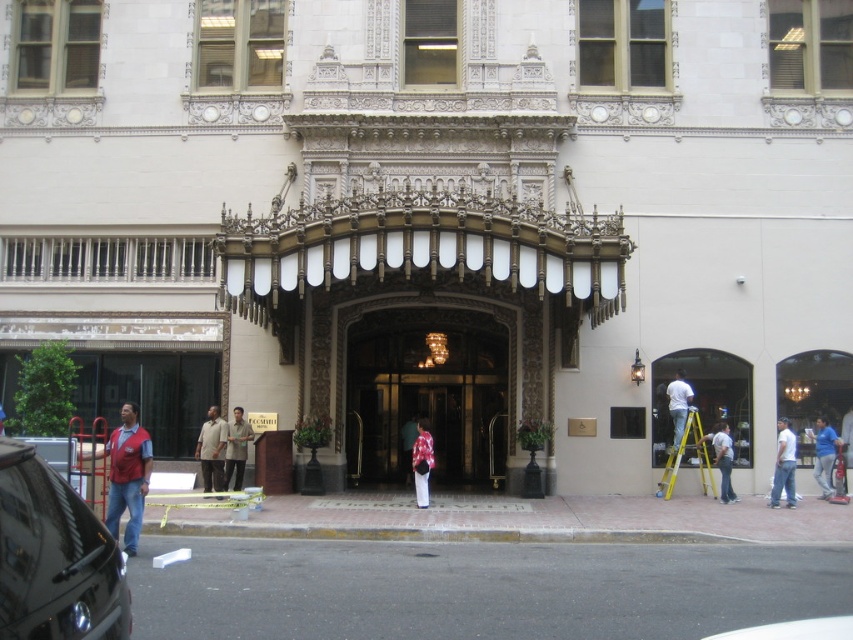
Is clear glass window at center below floral fabric dress at center?

Actually, clear glass window at center is above floral fabric dress at center.

Does clear glass window at center have a larger size compared to floral fabric dress at center?

Yes.

Is point (730, 368) closer to camera compared to point (425, 464)?

That is False.

The height and width of the screenshot is (640, 853). What are the coordinates of `clear glass window at center` in the screenshot? It's located at (704, 397).

Who is more distant from viewer, (206, 420) or (785, 461)?

Positioned behind is point (206, 420).

Who is positioned more to the left, khaki cotton shirt at center or white cotton shirt at lower right?

khaki cotton shirt at center is more to the left.

The image size is (853, 640). I want to click on khaki cotton shirt at center, so click(x=212, y=449).

Is shiny black car at lower left taller than light brown shirt at center?

No, shiny black car at lower left is not taller than light brown shirt at center.

Is shiny black car at lower left positioned before light brown shirt at center?

Yes, shiny black car at lower left is closer to the viewer.

What are the coordinates of `shiny black car at lower left` in the screenshot? It's located at (54, 557).

Where is `shiny black car at lower left`? The height and width of the screenshot is (640, 853). shiny black car at lower left is located at coordinates (54, 557).